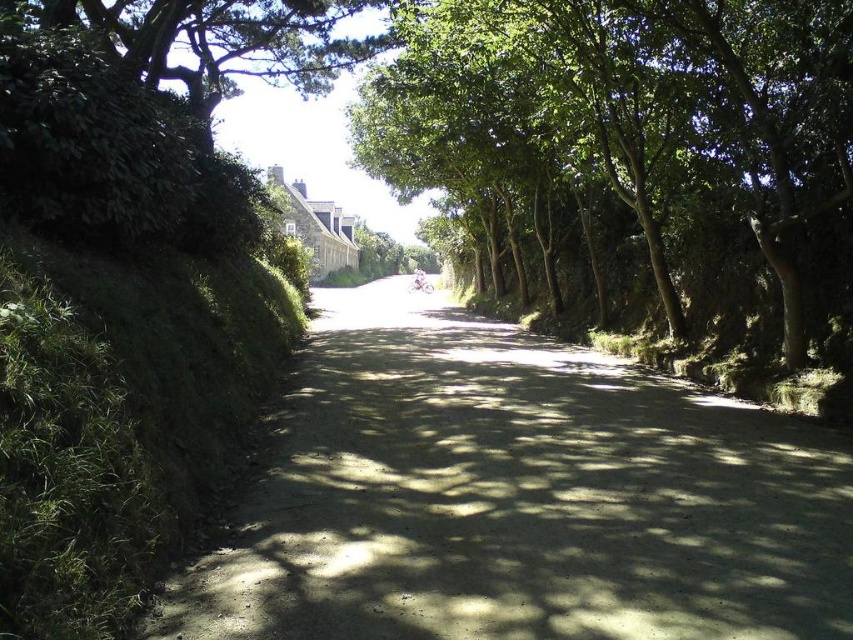
Question: Is dirt road at center positioned behind green leafy tree at center?

Choices:
 (A) no
 (B) yes

Answer: (A)

Question: Which point is farther from the camera taking this photo?

Choices:
 (A) (207, 52)
 (B) (502, 172)

Answer: (B)

Question: Can you confirm if dirt road at center is positioned below green leafy tree at upper left?

Choices:
 (A) no
 (B) yes

Answer: (B)

Question: Which object appears farthest from the camera in this image?

Choices:
 (A) dirt road at center
 (B) green leafy tree at center

Answer: (B)

Question: Which of these objects is positioned closest to the green leafy tree at center?

Choices:
 (A) green leafy tree at upper left
 (B) dirt road at center

Answer: (B)

Question: Is dirt road at center smaller than green leafy tree at center?

Choices:
 (A) yes
 (B) no

Answer: (A)